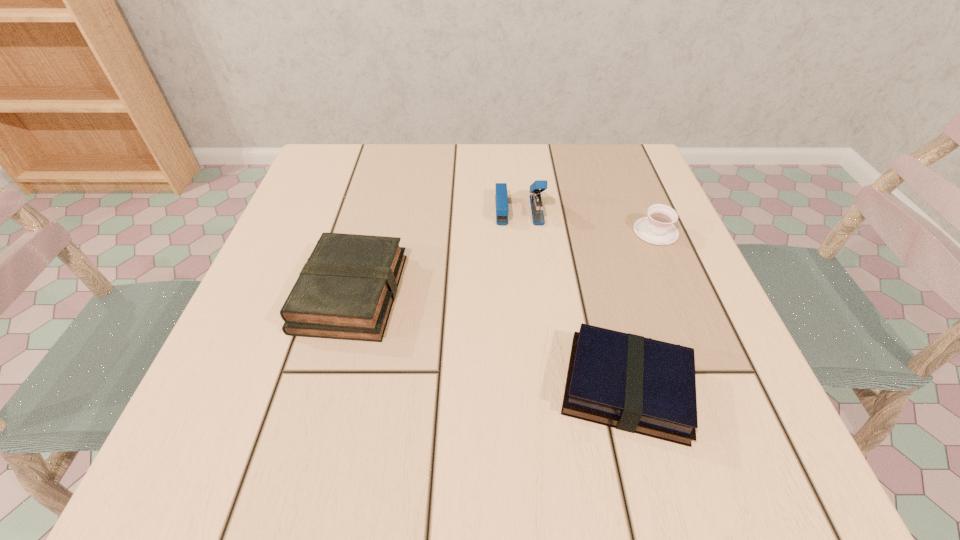
Locate an element on the screen. object located at the far edge is located at coordinates (501, 198).

Where is `object that is at the near edge`? The width and height of the screenshot is (960, 540). object that is at the near edge is located at coordinates (640, 385).

Where is `object at the left edge`? object at the left edge is located at coordinates (346, 289).

The height and width of the screenshot is (540, 960). Identify the location of book present at the right edge. tap(640, 385).

You are a GUI agent. You are given a task and a screenshot of the screen. Output one action in this format:
    pyautogui.click(x=<x>, y=<y>)
    Task: Click on the teacup that is at the right edge
    The width and height of the screenshot is (960, 540).
    Given the screenshot: What is the action you would take?
    pyautogui.click(x=658, y=228)

At what (x,y) coordinates should I click in order to perform the action: click on object present at the near right corner. Please return your answer as a coordinate pair (x, y). The width and height of the screenshot is (960, 540). Looking at the image, I should click on (640, 385).

In order to click on vacant region at the far edge of the desktop in this screenshot , I will do `click(516, 159)`.

The height and width of the screenshot is (540, 960). In the image, there is a desktop. Identify the location of vacant space at the near edge. (318, 476).

Where is `vacant space at the left edge`? This screenshot has height=540, width=960. vacant space at the left edge is located at coordinates (304, 386).

The image size is (960, 540). Identify the location of vacant space at the right edge of the desktop. (625, 206).